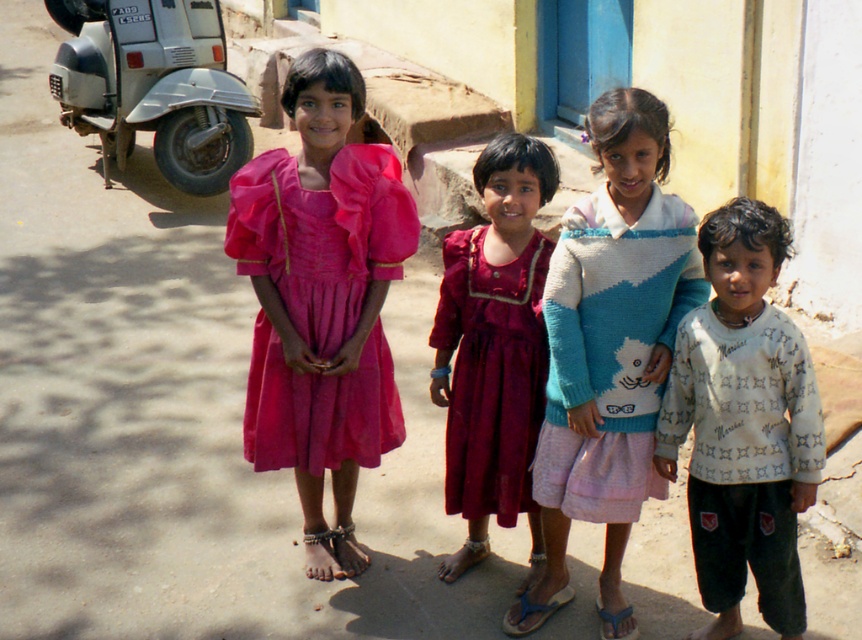
You are a photographer trying to capture a group photo of the four children. The children are currently positioned in a line from left to right as follows. The first child is the girl in a bright pink dress with puffed sleeves and a matching jacket tied around her waist. The second is the girl in a red dress with a white trim at the neckline. The third is the child in a blue and white sweater with a cartoon character design and a light pink skirt. The fourth is the child in a white printed sweater at right.

The white printed sweater at right is positioned at point (x=742, y=424), so to center the group photo, the photographer should adjust the children so that the white printed sweater at right is moved to the center of the frame.